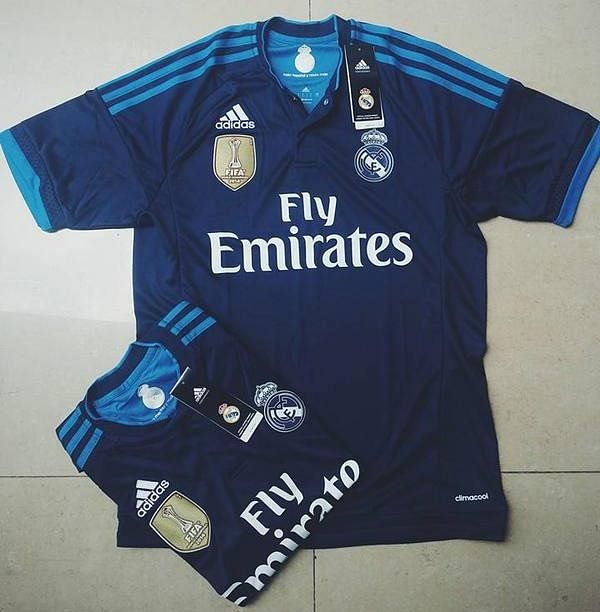
Identify the location of greyish, white tile background. This screenshot has height=612, width=600. (407, 572).